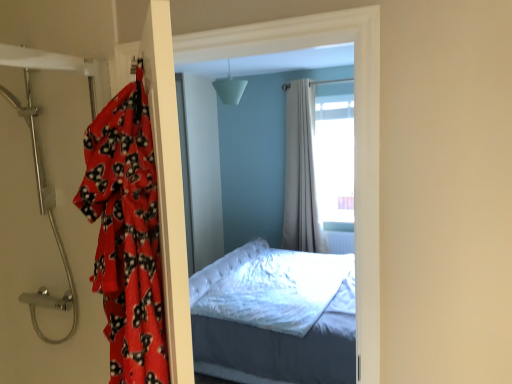
What do you see at coordinates (46, 220) in the screenshot? This screenshot has height=384, width=512. I see `metallic showerhead at left` at bounding box center [46, 220].

The image size is (512, 384). What are the coordinates of `fluffy red blanket at left` in the screenshot? It's located at (127, 235).

Locate an element on the screen. Image resolution: width=512 pixels, height=384 pixels. beige fabric curtain at center is located at coordinates (301, 172).

Is fluffy red blanket at left far away from metallic showerhead at left?

fluffy red blanket at left is actually quite close to metallic showerhead at left.

Does point (100, 142) appear closer or farther from the camera than point (21, 244)?

Point (100, 142) is closer to the camera than point (21, 244).

From the picture: Which is more to the right, fluffy red blanket at left or metallic showerhead at left?

fluffy red blanket at left is more to the right.

Which object is closer to the camera, fluffy red blanket at left or metallic showerhead at left?

fluffy red blanket at left is in front.

Considering the positions of objects metallic showerhead at left and beige fabric curtain at center in the image provided, who is more to the right, metallic showerhead at left or beige fabric curtain at center?

Positioned to the right is beige fabric curtain at center.

From a real-world perspective, who is located lower, metallic showerhead at left or beige fabric curtain at center?

In real-world perspective, beige fabric curtain at center is lower.

Is metallic showerhead at left not within beige fabric curtain at center?

That's correct, metallic showerhead at left is outside of beige fabric curtain at center.

Locate an element on the screen. The image size is (512, 384). door in front of the beige fabric curtain at center is located at coordinates (46, 220).

From the image's perspective, would you say metallic showerhead at left is positioned over fluffy red blanket at left?

Yes.

Is metallic showerhead at left turned away from fluffy red blanket at left?

No, fluffy red blanket at left is not at the back of metallic showerhead at left.

In terms of size, does metallic showerhead at left appear bigger or smaller than fluffy red blanket at left?

In the image, metallic showerhead at left appears to be larger than fluffy red blanket at left.

This screenshot has width=512, height=384. Identify the location of blanket below the metallic showerhead at left (from the image's perspective). (127, 235).

Which is correct: beige fabric curtain at center is inside metallic showerhead at left, or outside of it?

The correct answer is: outside.

Is beige fabric curtain at center further to camera compared to metallic showerhead at left?

Yes, it is behind metallic showerhead at left.

From the image's perspective, is beige fabric curtain at center above or below metallic showerhead at left?

beige fabric curtain at center is above metallic showerhead at left.

Considering the sizes of objects beige fabric curtain at center and metallic showerhead at left in the image provided, who is taller, beige fabric curtain at center or metallic showerhead at left?

With more height is beige fabric curtain at center.

The image size is (512, 384). I want to click on curtain above the fluffy red blanket at left (from the image's perspective), so click(301, 172).

Is fluffy red blanket at left taller than beige fabric curtain at center?

Incorrect, the height of fluffy red blanket at left is not larger of that of beige fabric curtain at center.

Considering the sizes of objects fluffy red blanket at left and beige fabric curtain at center in the image provided, who is thinner, fluffy red blanket at left or beige fabric curtain at center?

beige fabric curtain at center.

Would you say fluffy red blanket at left is inside or outside beige fabric curtain at center?

fluffy red blanket at left exists outside the volume of beige fabric curtain at center.

From a real-world perspective, who is located higher, beige fabric curtain at center or fluffy red blanket at left?

In real-world perspective, fluffy red blanket at left is above.

Can you confirm if beige fabric curtain at center is positioned to the left of fluffy red blanket at left?

No, beige fabric curtain at center is not to the left of fluffy red blanket at left.

From the image's perspective, between beige fabric curtain at center and fluffy red blanket at left, who is located below?

fluffy red blanket at left.

What are the coordinates of `blanket that is on the right side of metallic showerhead at left` in the screenshot? It's located at (127, 235).

The width and height of the screenshot is (512, 384). I want to click on curtain that is behind the metallic showerhead at left, so click(x=301, y=172).

Which object lies nearer to the anchor point fluffy red blanket at left, metallic showerhead at left or beige fabric curtain at center?

Among the two, metallic showerhead at left is located nearer to fluffy red blanket at left.

From the image, which object appears to be farther from fluffy red blanket at left, beige fabric curtain at center or metallic showerhead at left?

beige fabric curtain at center is positioned further to the anchor fluffy red blanket at left.

When comparing their distances from beige fabric curtain at center, does metallic showerhead at left or fluffy red blanket at left seem closer?

metallic showerhead at left.

From the image, which object appears to be farther from metallic showerhead at left, fluffy red blanket at left or beige fabric curtain at center?

beige fabric curtain at center lies further to metallic showerhead at left than the other object.

Looking at the image, which one is located further to beige fabric curtain at center, fluffy red blanket at left or metallic showerhead at left?

fluffy red blanket at left is positioned further to the anchor beige fabric curtain at center.

When comparing their distances from metallic showerhead at left, does beige fabric curtain at center or fluffy red blanket at left seem further?

Among the two, beige fabric curtain at center is located further to metallic showerhead at left.

You are a GUI agent. You are given a task and a screenshot of the screen. Output one action in this format:
    pyautogui.click(x=<x>, y=<y>)
    Task: Click on the door between fluffy red blanket at left and beige fabric curtain at center along the z-axis
    
    Given the screenshot: What is the action you would take?
    pyautogui.click(x=46, y=220)